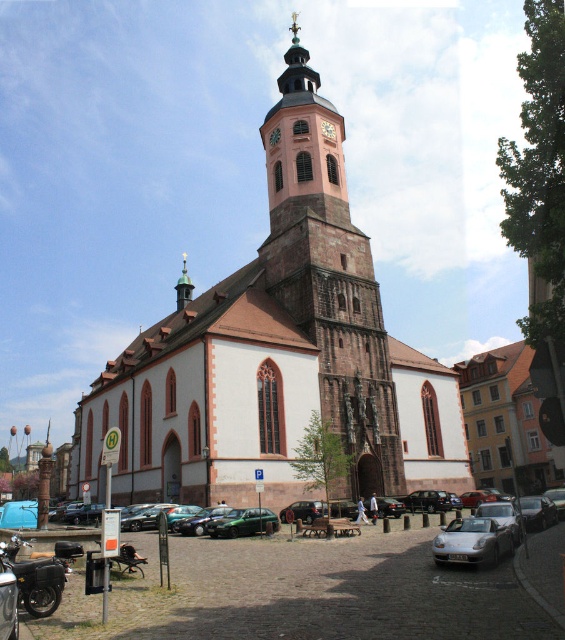
Question: Which object is positioned closest to the metallic silver car at center?

Choices:
 (A) pink stone church at center
 (B) green matte car at lower center

Answer: (B)

Question: Among these objects, which one is nearest to the camera?

Choices:
 (A) satin silver car at lower center
 (B) shiny black motorcycle at lower left
 (C) metallic silver car at center
 (D) gold plated spire at upper center

Answer: (B)

Question: Does shiny black motorcycle at lower left have a smaller size compared to satin silver car at lower center?

Choices:
 (A) yes
 (B) no

Answer: (B)

Question: Which is nearer to the gold plated spire at upper center?

Choices:
 (A) pink stone church at center
 (B) shiny black motorcycle at lower left

Answer: (A)

Question: Is satin silver car at lower center in front of metallic silver car at center?

Choices:
 (A) no
 (B) yes

Answer: (B)

Question: Considering the relative positions of pink stone church at center and shiny black motorcycle at lower left in the image provided, where is pink stone church at center located with respect to shiny black motorcycle at lower left?

Choices:
 (A) left
 (B) right

Answer: (B)